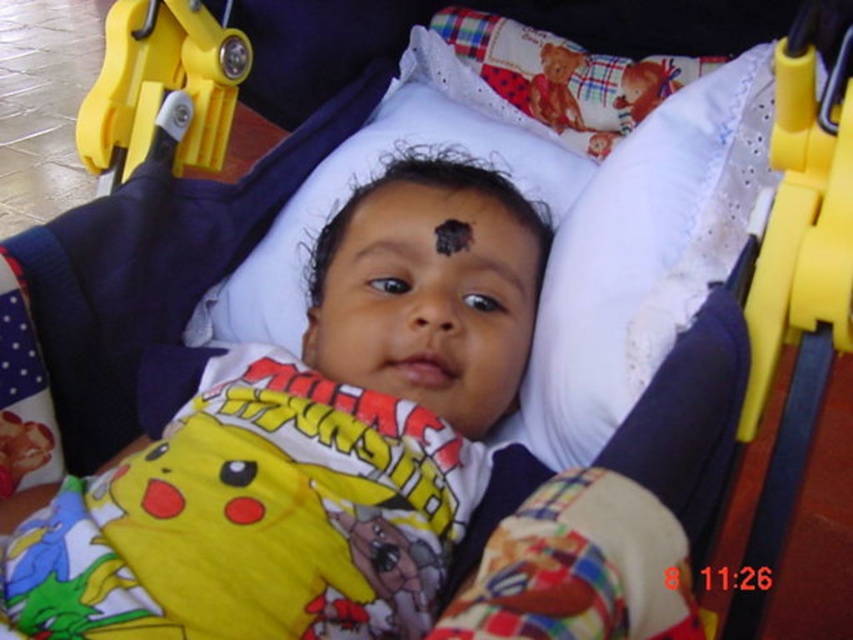
You are a parent trying to adjust the position of the white lace pillow at upper center and the yellow plastic stroller at right. Which object is closer to you?

The white lace pillow at upper center is closer to you because the yellow plastic stroller at right is behind it.

You are a photographer trying to capture the baby in the stroller. You need to place a small prop at point (x=643, y=257). According to the scene description, where exactly should you place the prop?

The prop should be placed on the white lace pillow at upper center, as point (x=643, y=257) is located there.

You are a photographer setting up a shot of the baby in the stroller. You need to ensure that the yellow cotton shirt at center and the yellow plastic buckle at upper left are both visible in the frame. Given their sizes, which object should you focus on first to make sure it fits into the composition?

The yellow cotton shirt at center is much taller than the yellow plastic buckle at upper left, so you should focus on ensuring the yellow cotton shirt at center is fully visible first since it takes up more vertical space in the frame.